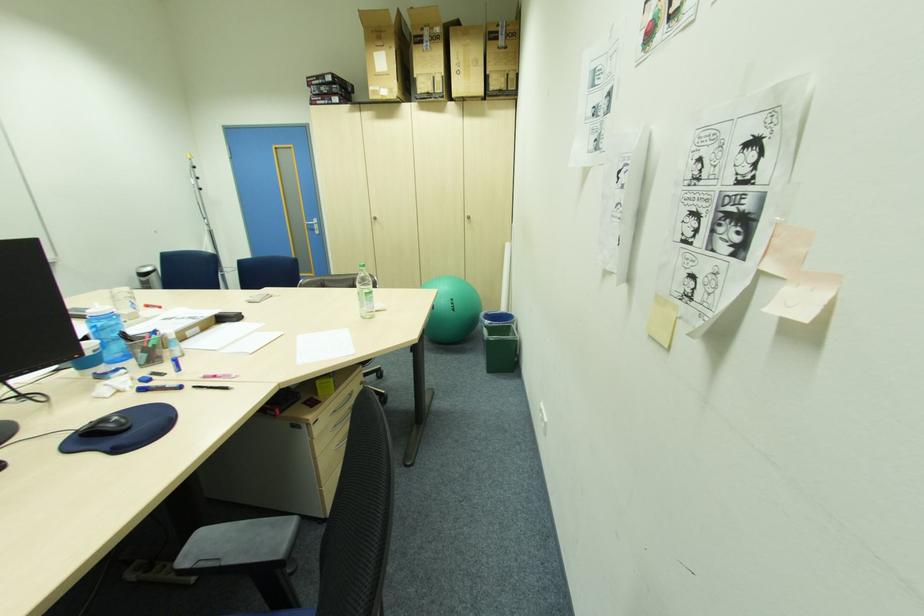
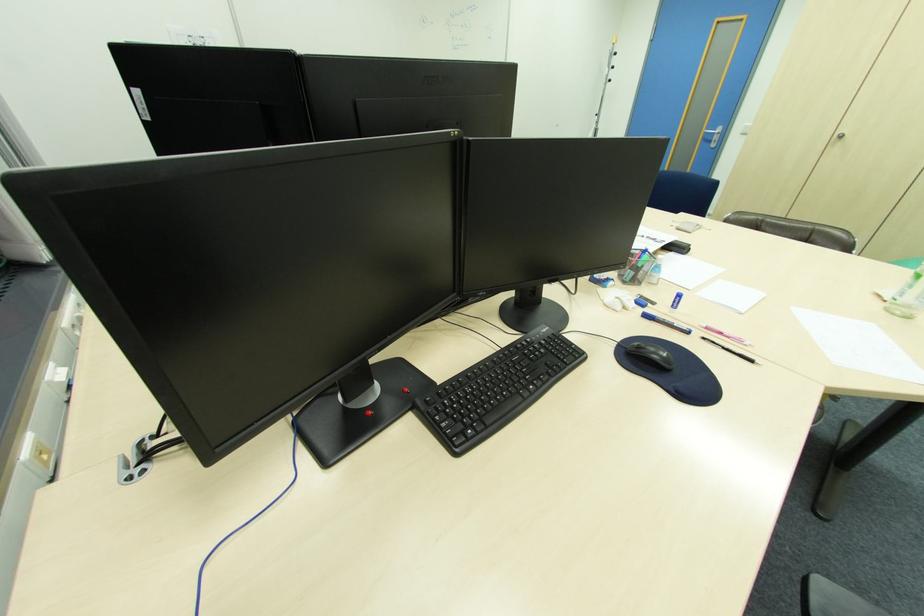
Based on the continuous images, in which direction is the camera rotating?

The rotation direction of the camera is left-down.